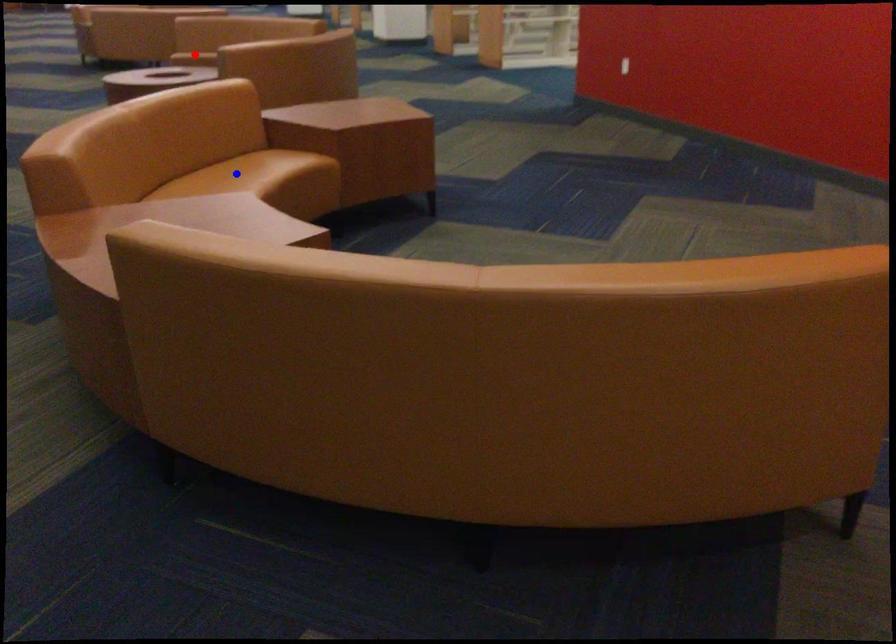
Question: Two points are marked on the image. Which point is closer to the camera?

Choices:
 (A) Blue point is closer.
 (B) Red point is closer.

Answer: (A)